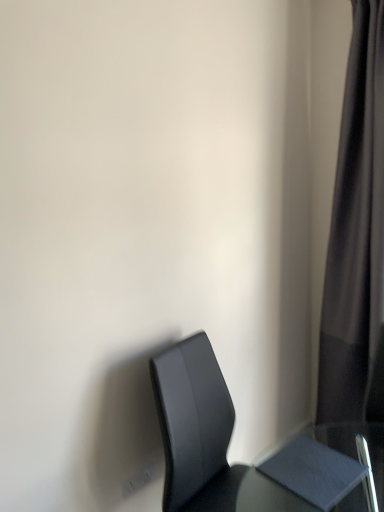
Question: Can you confirm if matte black chair at lower right is shorter than black fabric curtain at right?

Choices:
 (A) no
 (B) yes

Answer: (B)

Question: From the image's perspective, would you say matte black chair at lower right is shown under black fabric curtain at right?

Choices:
 (A) yes
 (B) no

Answer: (A)

Question: Is matte black chair at lower right located outside black fabric curtain at right?

Choices:
 (A) yes
 (B) no

Answer: (A)

Question: Considering the relative sizes of matte black chair at lower right and black fabric curtain at right in the image provided, is matte black chair at lower right wider than black fabric curtain at right?

Choices:
 (A) yes
 (B) no

Answer: (A)

Question: Considering the relative positions of matte black chair at lower right and black fabric curtain at right in the image provided, is matte black chair at lower right to the right of black fabric curtain at right from the viewer's perspective?

Choices:
 (A) yes
 (B) no

Answer: (B)

Question: From the image's perspective, is black fabric curtain at right above or below matte black chair at lower right?

Choices:
 (A) below
 (B) above

Answer: (B)

Question: Considering the positions of black fabric curtain at right and matte black chair at lower right in the image, is black fabric curtain at right bigger or smaller than matte black chair at lower right?

Choices:
 (A) small
 (B) big

Answer: (B)

Question: Is black fabric curtain at right to the left or to the right of matte black chair at lower right in the image?

Choices:
 (A) left
 (B) right

Answer: (B)

Question: Is black fabric curtain at right wider or thinner than matte black chair at lower right?

Choices:
 (A) thin
 (B) wide

Answer: (A)

Question: Considering the positions of matte black chair at lower right and black fabric curtain at right in the image, is matte black chair at lower right bigger or smaller than black fabric curtain at right?

Choices:
 (A) small
 (B) big

Answer: (A)

Question: Looking at their shapes, would you say matte black chair at lower right is wider or thinner than black fabric curtain at right?

Choices:
 (A) thin
 (B) wide

Answer: (B)

Question: In terms of height, does matte black chair at lower right look taller or shorter compared to black fabric curtain at right?

Choices:
 (A) short
 (B) tall

Answer: (A)

Question: Does point (274, 495) appear closer or farther from the camera than point (352, 251)?

Choices:
 (A) farther
 (B) closer

Answer: (B)

Question: From a real-world perspective, is matte gray table at lower right positioned above or below black fabric curtain at right?

Choices:
 (A) above
 (B) below

Answer: (B)

Question: In terms of width, does matte gray table at lower right look wider or thinner when compared to black fabric curtain at right?

Choices:
 (A) wide
 (B) thin

Answer: (B)